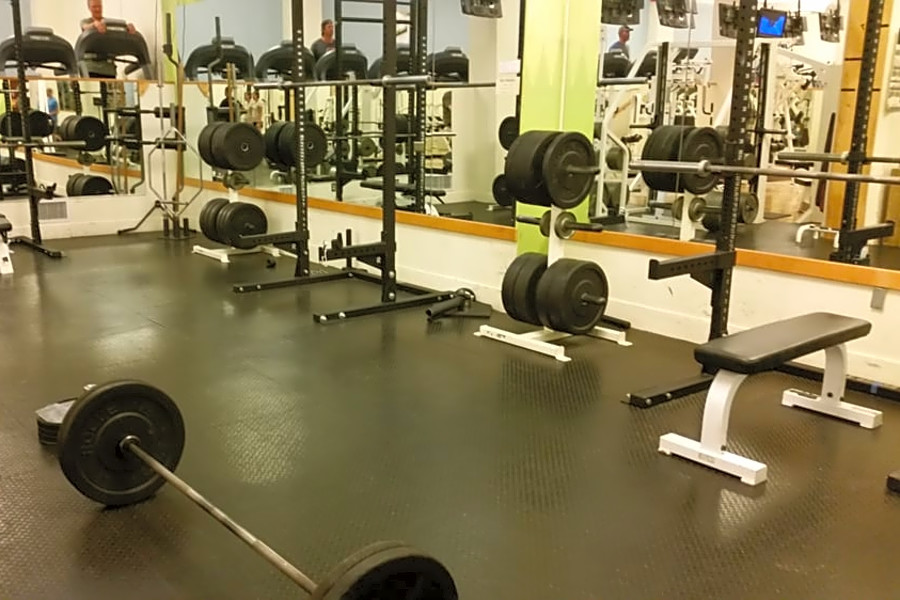
You are a GUI agent. You are given a task and a screenshot of the screen. Output one action in this format:
    pyautogui.click(x=<x>, y=<y>)
    Task: Click on the treadmill
    Image resolution: width=900 pixels, height=600 pixels.
    Given the screenshot: What is the action you would take?
    pyautogui.click(x=39, y=42), pyautogui.click(x=112, y=37), pyautogui.click(x=217, y=51), pyautogui.click(x=282, y=56), pyautogui.click(x=352, y=61), pyautogui.click(x=400, y=60), pyautogui.click(x=447, y=62)